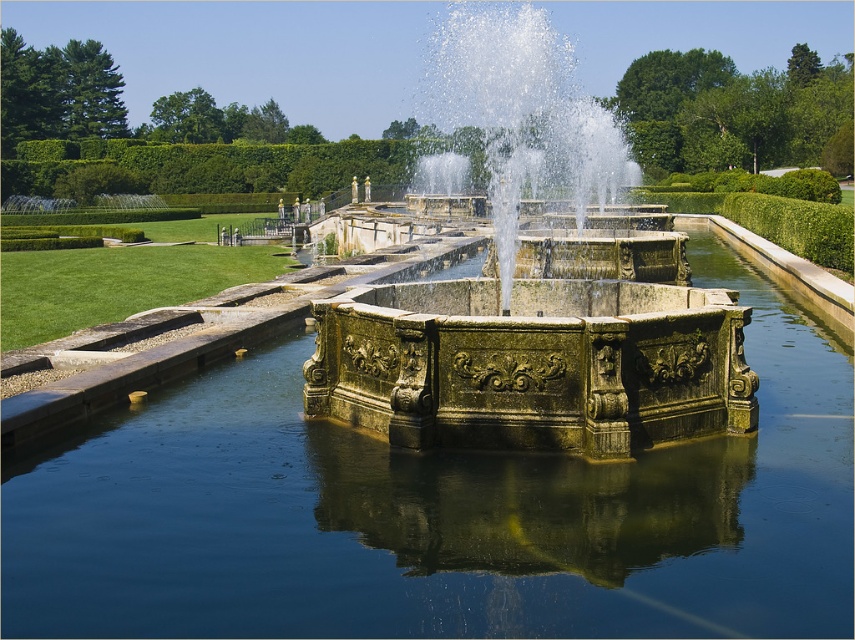
You are standing in the garden and see the greenish stone water at center and the greenish stone fountain at center. Which one is located lower in the scene?

The greenish stone water at center is located below the greenish stone fountain at center, so it is lower in the scene.

You are standing in the garden and want to know which object is taller between the greenish stone water at center and the greenish stone fountain at center. Which one is taller?

The greenish stone fountain at center is taller than the greenish stone water at center.